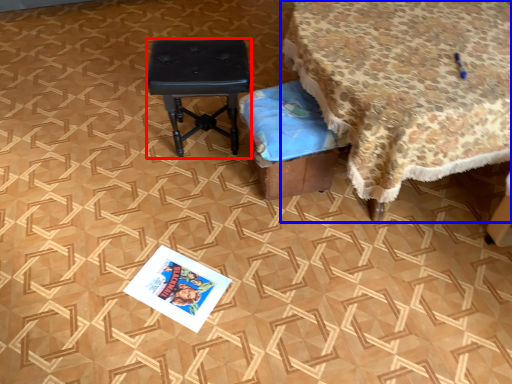
Question: Which point is closer to the camera, stool (highlighted by a red box) or table (highlighted by a blue box)?

Choices:
 (A) stool
 (B) table

Answer: (B)